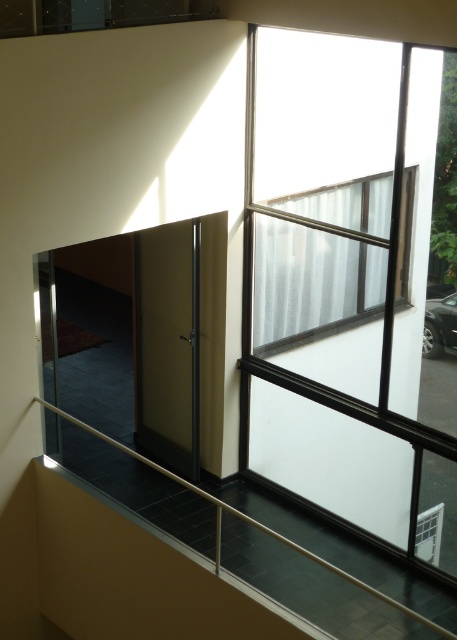
Question: Can you confirm if clear glass window at upper center is positioned to the left of metallic silver railing at lower center?

Choices:
 (A) no
 (B) yes

Answer: (A)

Question: Can you confirm if clear glass window at upper right is smaller than metallic silver railing at lower center?

Choices:
 (A) no
 (B) yes

Answer: (B)

Question: Among these objects, which one is nearest to the camera?

Choices:
 (A) clear glass window at upper center
 (B) metallic silver railing at lower center
 (C) clear glass window at upper right

Answer: (B)

Question: Which point is farther from the camera taking this photo?

Choices:
 (A) (325, 241)
 (B) (317, 388)
 (C) (398, 602)

Answer: (B)

Question: Can you confirm if clear glass window at upper right is positioned above metallic silver railing at lower center?

Choices:
 (A) no
 (B) yes

Answer: (B)

Question: Which point appears farthest from the camera in this image?

Choices:
 (A) (340, 573)
 (B) (407, 58)
 (C) (287, 296)

Answer: (C)